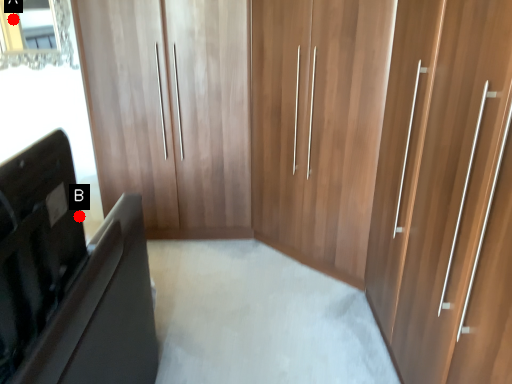
Question: Two points are circled on the image, labeled by A and B beside each circle. Which point appears farthest from the camera in this image?

Choices:
 (A) A is further
 (B) B is further

Answer: (A)